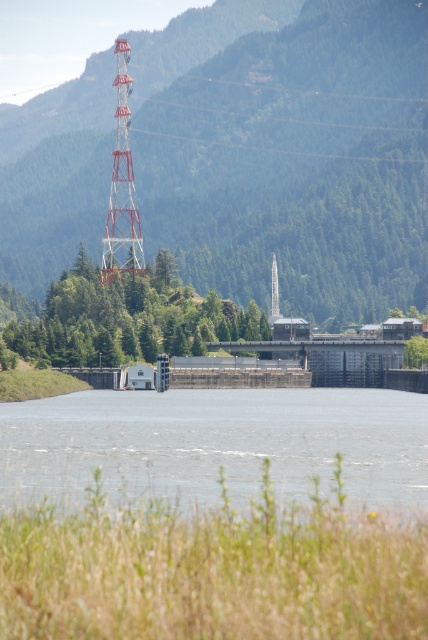
Is point (115, 84) closer to viewer compared to point (278, 316)?

No, it is behind (278, 316).

Is metallic red tower at upper left wider than white metal tower at center?

Yes.

Image resolution: width=428 pixels, height=640 pixels. What are the coordinates of `metallic red tower at upper left` in the screenshot? It's located at (121, 188).

At what (x,y) coordinates should I click in order to perform the action: click on metallic red tower at upper left. Please return your answer as a coordinate pair (x, y). The image size is (428, 640). Looking at the image, I should click on (121, 188).

Does gray concrete river at center have a greater height compared to white metal tower at center?

No, gray concrete river at center is not taller than white metal tower at center.

Is gray concrete river at center smaller than white metal tower at center?

Actually, gray concrete river at center might be larger than white metal tower at center.

Locate an element on the screen. The image size is (428, 640). gray concrete river at center is located at coordinates (216, 445).

Looking at this image, is gray concrete river at center behind metallic red tower at upper left?

No, gray concrete river at center is closer to the viewer.

Is gray concrete river at center shorter than metallic red tower at upper left?

Yes.

Is point (225, 404) positioned before point (121, 180)?

Yes, point (225, 404) is in front of point (121, 180).

The width and height of the screenshot is (428, 640). I want to click on gray concrete river at center, so click(216, 445).